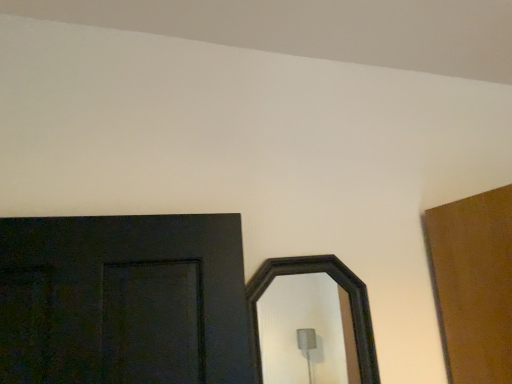
Question: Should I look upward or downward to see black wooden mirror at center?

Choices:
 (A) down
 (B) up

Answer: (A)